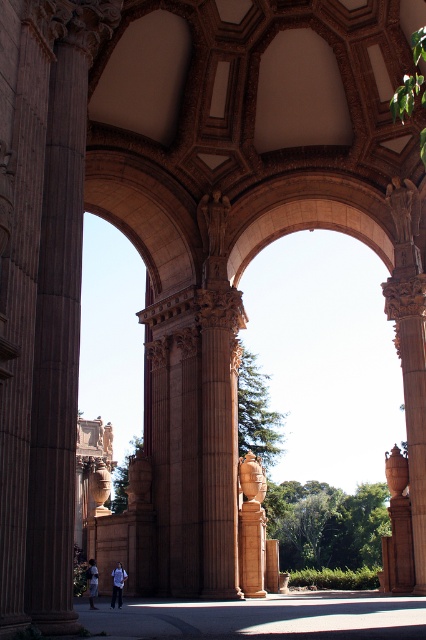
Based on the photo, you are standing in front of the grand architectural structure described. You need to locate the smooth tan stone column at center. Where exactly is it positioned in the image?

The smooth tan stone column at center is positioned at point 0.823 along the horizontal axis and 0.592 along the vertical axis.

You are standing in front of the grand structure and want to take a photo of the brown polished stone column at left and the denim pants at lower left. Which object should you position closer to the left side of your camera frame?

The denim pants at lower left should be positioned closer to the left side of your camera frame because the brown polished stone column at left is to the right of denim pants at lower left.

You are an architect analyzing the proportions of the structure. Given that the smooth tan stone column at center and the white cotton shirt at lower center are both visible in the scene, which object has a greater width?

The smooth tan stone column at center has a greater width than the white cotton shirt at lower center, as stated in the description.